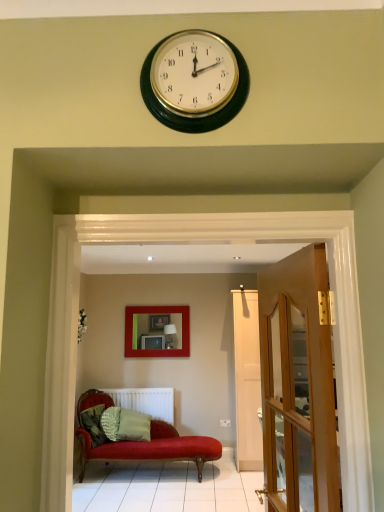
Question: Looking at the image, does matte red picture frame at center seem bigger or smaller compared to green textured pillow at lower left, which is the second pillow in right-to-left order?

Choices:
 (A) big
 (B) small

Answer: (A)

Question: Is matte red picture frame at center spatially inside green textured pillow at lower left, which is the second pillow in right-to-left order, or outside of it?

Choices:
 (A) inside
 (B) outside

Answer: (B)

Question: Which of these objects is positioned closest to the wooden glass door at right?

Choices:
 (A) green textured pillow at center, the first pillow viewed from the right
 (B) green textured pillow at lower left, the 1th pillow in the left-to-right sequence
 (C) matte red picture frame at center
 (D) white matte radiator at lower center

Answer: (B)

Question: Based on their relative distances, which object is nearer to the green textured pillow at center, the first pillow viewed from the right?

Choices:
 (A) matte red picture frame at center
 (B) wooden glass door at right
 (C) white matte radiator at lower center
 (D) green textured pillow at lower left, the 1th pillow in the left-to-right sequence

Answer: (D)